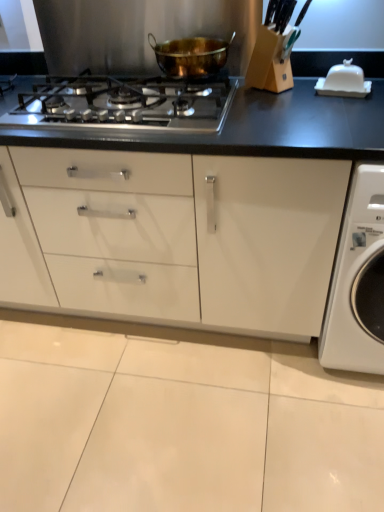
Question: Does satin silver gas stove at center touch white glossy washing machine at right?

Choices:
 (A) no
 (B) yes

Answer: (A)

Question: From the image's perspective, is satin silver gas stove at center over white glossy washing machine at right?

Choices:
 (A) no
 (B) yes

Answer: (B)

Question: Does satin silver gas stove at center contain white glossy washing machine at right?

Choices:
 (A) yes
 (B) no

Answer: (B)

Question: Does satin silver gas stove at center have a greater width compared to white glossy washing machine at right?

Choices:
 (A) yes
 (B) no

Answer: (B)

Question: Does satin silver gas stove at center come in front of white glossy washing machine at right?

Choices:
 (A) no
 (B) yes

Answer: (A)

Question: Would you say gold metallic pot at center is inside or outside white glossy washing machine at right?

Choices:
 (A) outside
 (B) inside

Answer: (A)

Question: In the image, is gold metallic pot at center positioned in front of or behind white glossy washing machine at right?

Choices:
 (A) front
 (B) behind

Answer: (B)

Question: In terms of width, does gold metallic pot at center look wider or thinner when compared to white glossy washing machine at right?

Choices:
 (A) wide
 (B) thin

Answer: (B)

Question: From a real-world perspective, is gold metallic pot at center physically located above or below white glossy washing machine at right?

Choices:
 (A) below
 (B) above

Answer: (B)

Question: In terms of size, does white glossy washing machine at right appear bigger or smaller than satin silver gas stove at center?

Choices:
 (A) small
 (B) big

Answer: (B)

Question: From the image's perspective, relative to satin silver gas stove at center, is white glossy washing machine at right above or below?

Choices:
 (A) above
 (B) below

Answer: (B)

Question: In terms of height, does white glossy washing machine at right look taller or shorter compared to satin silver gas stove at center?

Choices:
 (A) short
 (B) tall

Answer: (B)

Question: Would you say white glossy washing machine at right is to the left or to the right of satin silver gas stove at center in the picture?

Choices:
 (A) right
 (B) left

Answer: (A)

Question: From the image's perspective, relative to gold metallic pot at center, is white glossy washing machine at right above or below?

Choices:
 (A) above
 (B) below

Answer: (B)

Question: Considering the positions of white glossy washing machine at right and gold metallic pot at center in the image, is white glossy washing machine at right taller or shorter than gold metallic pot at center?

Choices:
 (A) tall
 (B) short

Answer: (A)